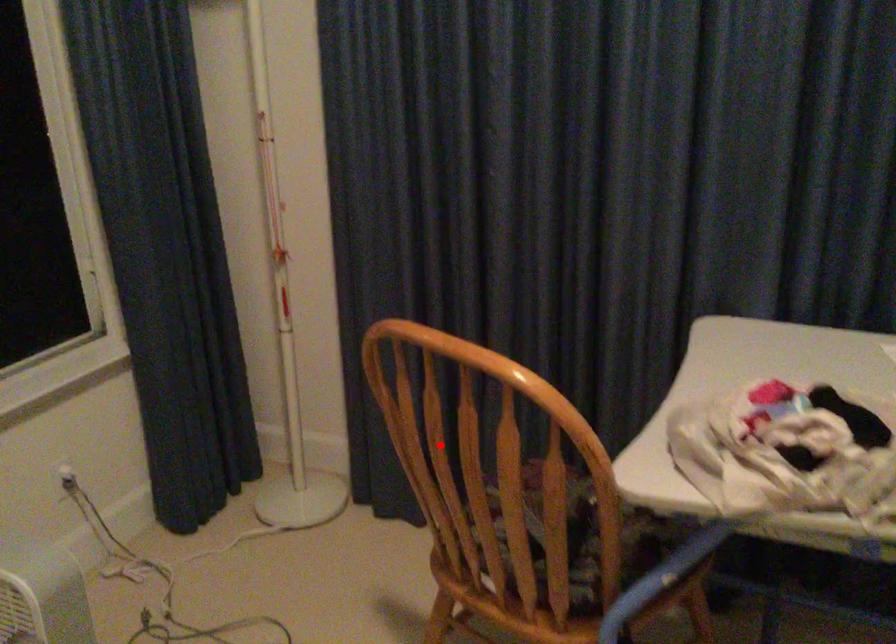
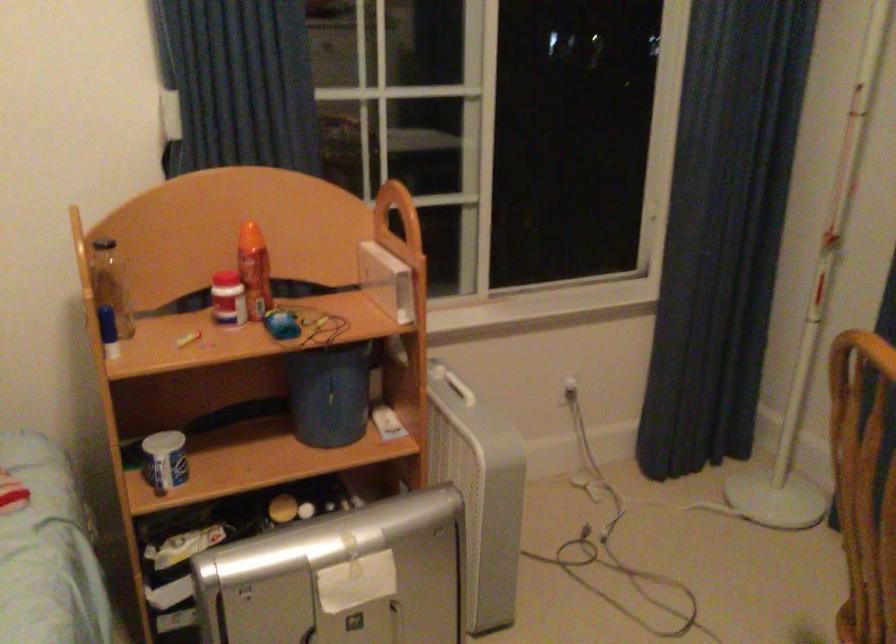
Question: I am providing you with two images of the same scene from different viewpoints. Given a red point in image1, look at the same physical point in image2. Is it:

Choices:
 (A) Closer to the viewpoint
 (B) Farther from the viewpoint

Answer: (A)